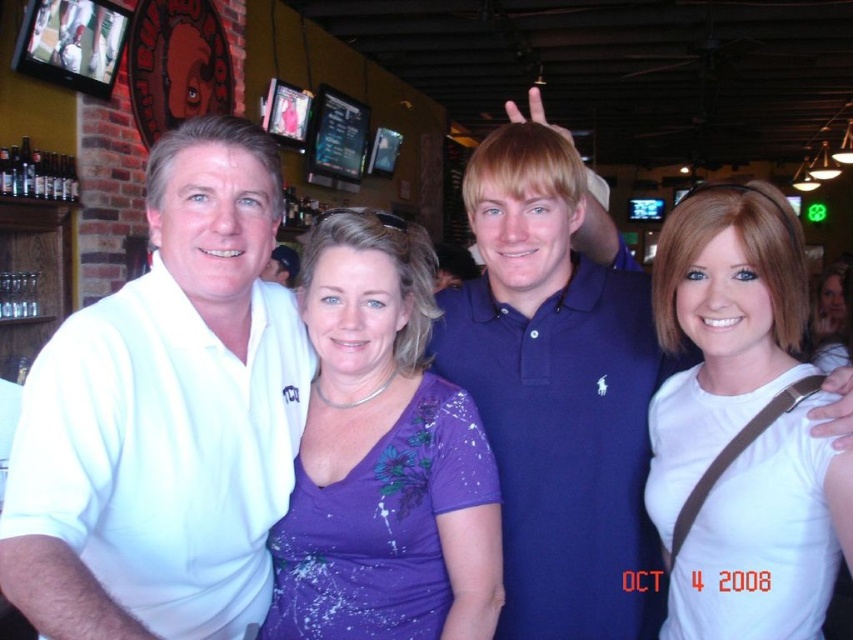
You are at a party and want to introduce yourself to the person wearing the blue cotton polo shirt at center and the purple matte shirt at center. Which person should you approach first if you want to start with the one on the left?

You should approach the purple matte shirt at center first because the blue cotton polo shirt at center is positioned on the right side of purple matte shirt at center, making the purple one the leftmost.

You are at a bar with two purple outfits in the center. The purple matte shirt at center and the purple fabric dress at center are both visible. Which one is taller?

The purple matte shirt at center is taller than the purple fabric dress at center.